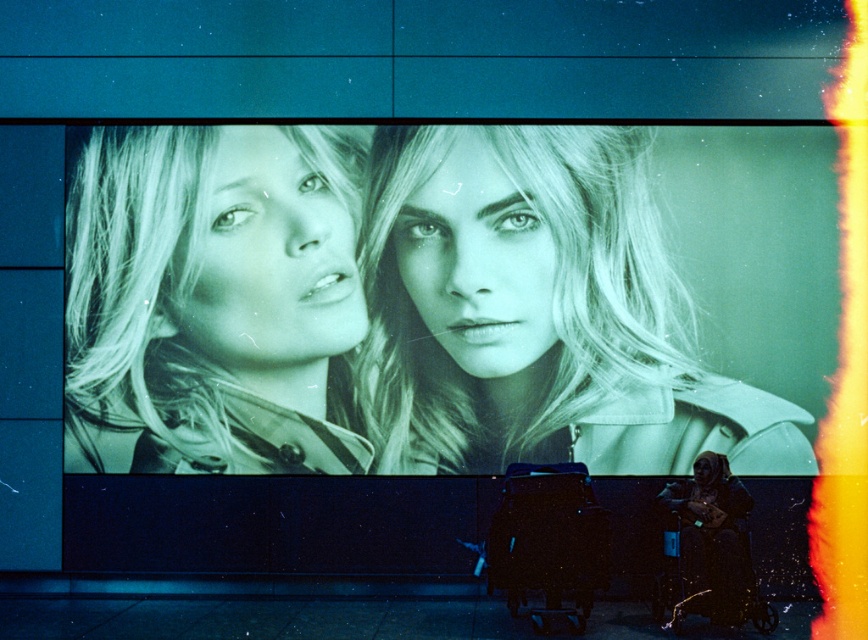
Based on the scene description, which object is taller between the matte beige trench coat at center and the monochrome fabric at left?

The monochrome fabric at left is taller than the matte beige trench coat at center.

You are a fashion designer analyzing the billboard. You notice the matte beige trench coat at center and the monochrome fabric at left. Which one has a greater width?

The matte beige trench coat at center has a greater width than the monochrome fabric at left.